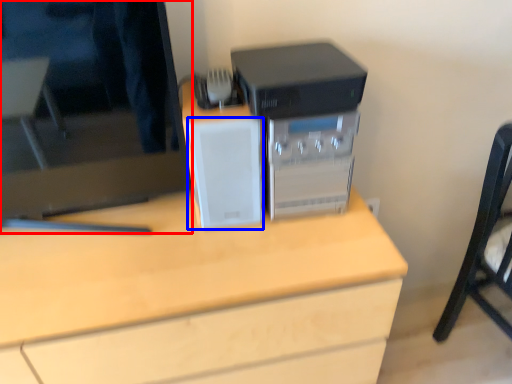
Question: Which point is further to the camera, computer monitor (highlighted by a red box) or speaker (highlighted by a blue box)?

Choices:
 (A) computer monitor
 (B) speaker

Answer: (B)